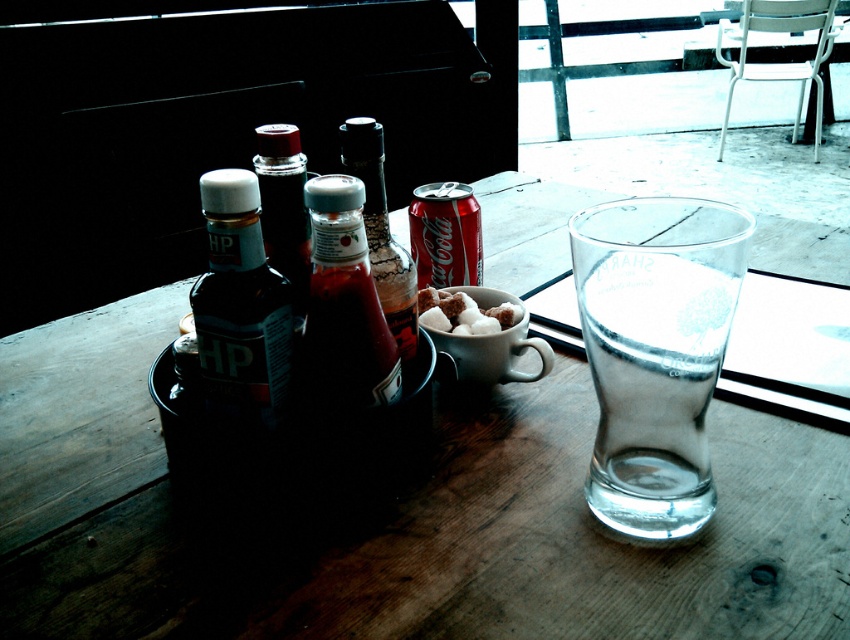
Question: Which point appears closest to the camera in this image?

Choices:
 (A) (443, 305)
 (B) (381, 317)
 (C) (270, 218)

Answer: (B)

Question: Does wooden table at center have a lesser width compared to white fluffy sugar cubes at center?

Choices:
 (A) no
 (B) yes

Answer: (A)

Question: Which object appears closest to the camera in this image?

Choices:
 (A) matte glass bottle at center
 (B) matte plastic hp sauce at left
 (C) red matte coca-cola can at center
 (D) translucent glass bottle at center

Answer: (B)

Question: Can you confirm if matte plastic hp sauce at left is positioned to the right of matte glass ketchup at center?

Choices:
 (A) no
 (B) yes

Answer: (A)

Question: Which point is farther from the camera taking this photo?

Choices:
 (A) (265, 141)
 (B) (276, 276)
 (C) (367, 353)

Answer: (A)

Question: Is transparent glass at right thinner than white fluffy sugar cubes at center?

Choices:
 (A) yes
 (B) no

Answer: (B)